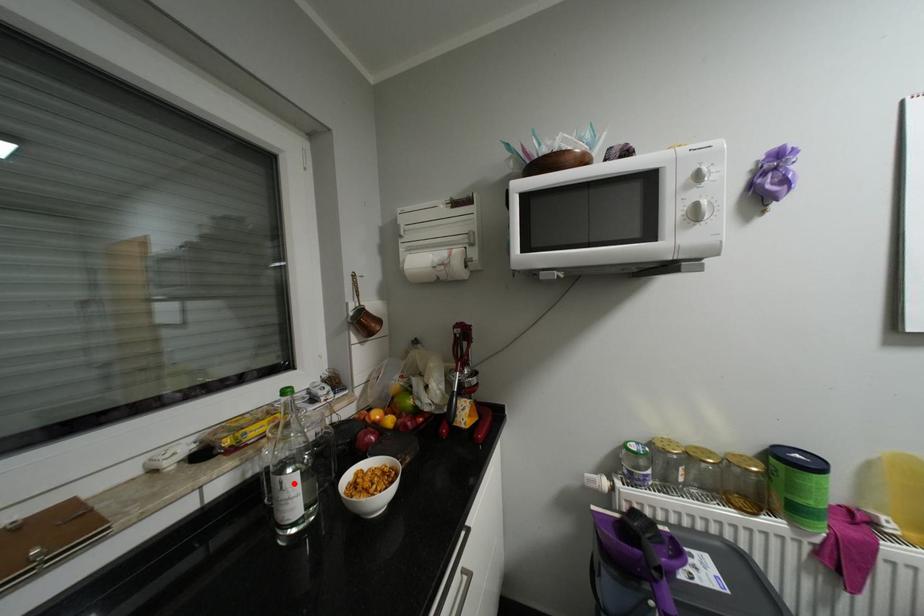
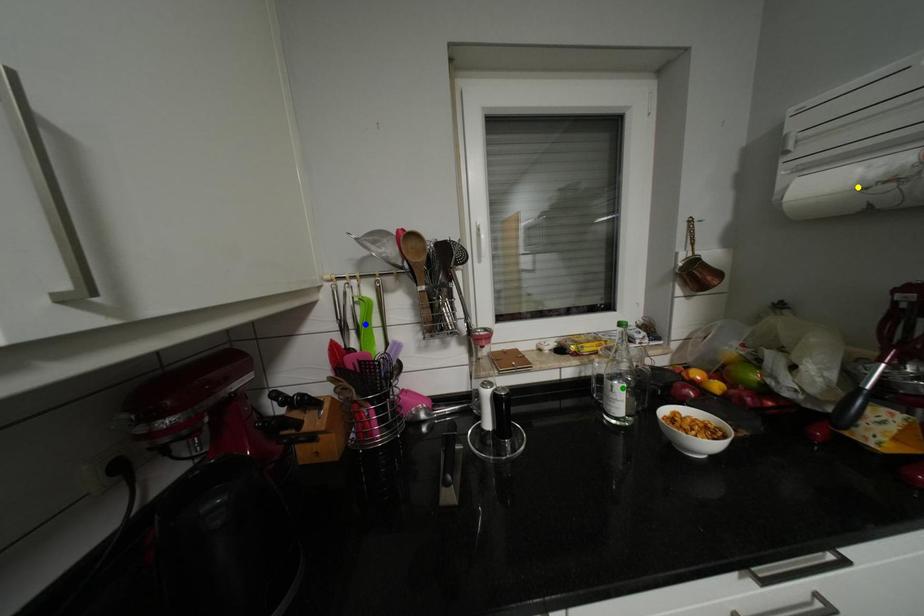
Question: I am providing you with two images of the same scene from different viewpoints. A red point is marked on the first image. You are given multiple points on the second image. Can you choose the point in image 2 that corresponds to the point in image 1?

Choices:
 (A) green point
 (B) yellow point
 (C) blue point

Answer: (A)